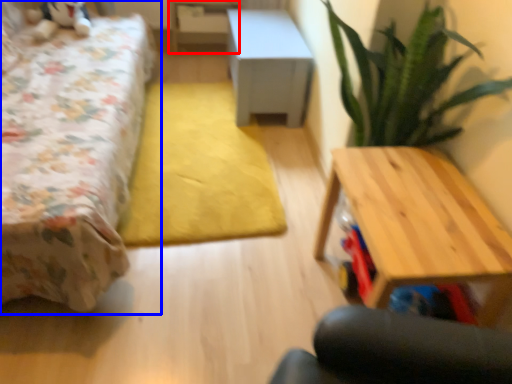
Question: Which object is closer to the camera taking this photo, table (highlighted by a red box) or bed (highlighted by a blue box)?

Choices:
 (A) table
 (B) bed

Answer: (B)